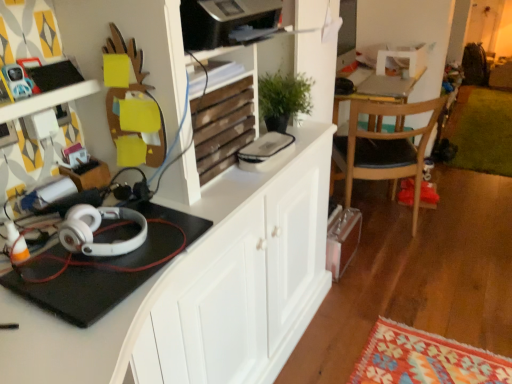
Where is `vacant space to the right of white matte headphones at left`? vacant space to the right of white matte headphones at left is located at coordinates (165, 238).